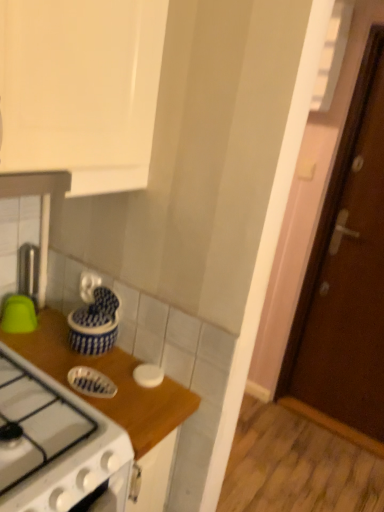
Locate an element on the screen. vacant area that is in front of green matte bowl at left, placed as the 1th kitchen appliance when sorted from left to right is located at coordinates (28, 345).